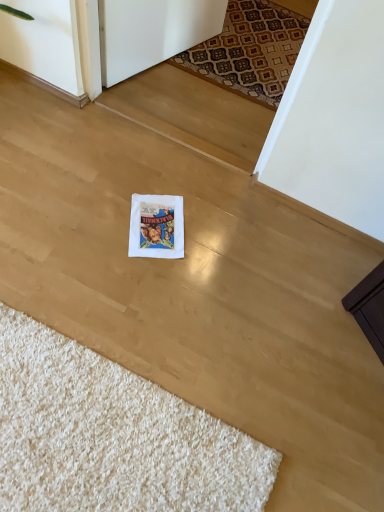
Question: Do you think patterned carpet at upper center is within white paper postcard at center, or outside of it?

Choices:
 (A) inside
 (B) outside

Answer: (B)

Question: Does point (192, 65) appear closer or farther from the camera than point (145, 232)?

Choices:
 (A) closer
 (B) farther

Answer: (B)

Question: Which is farther from the white paper postcard at center?

Choices:
 (A) patterned carpet at upper center
 (B) white shaggy rug at lower left

Answer: (A)

Question: Which object is the farthest from the white paper postcard at center?

Choices:
 (A) white shaggy rug at lower left
 (B) patterned carpet at upper center

Answer: (B)